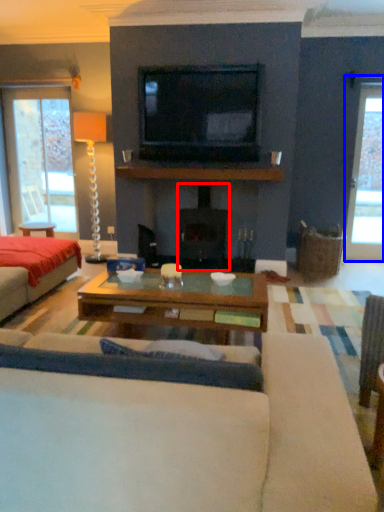
Question: Which point is further to the camera, fireplace (highlighted by a red box) or window (highlighted by a blue box)?

Choices:
 (A) fireplace
 (B) window

Answer: (B)